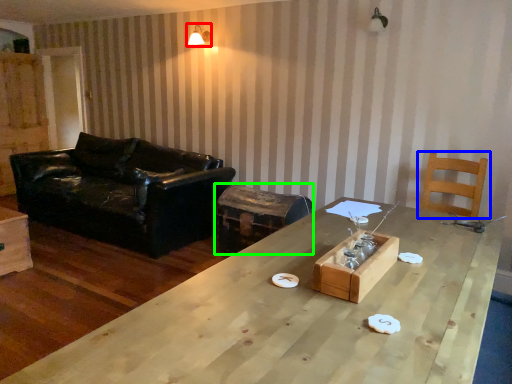
Question: Which object is positioned farthest from light fixture (highlighted by a red box)? Select from chair (highlighted by a blue box) and swivel chair (highlighted by a green box).

Choices:
 (A) chair
 (B) swivel chair

Answer: (A)